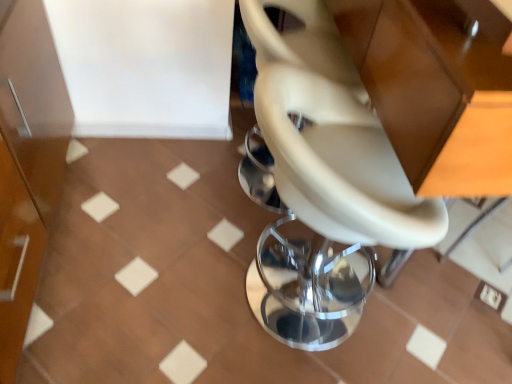
This screenshot has height=384, width=512. I want to click on free spot to the left of white glossy toilet at center, so click(x=167, y=289).